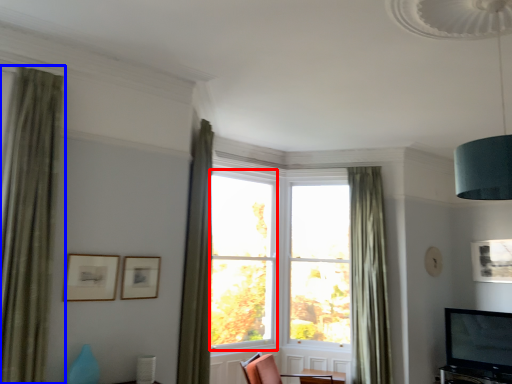
Question: Which object is further to the camera taking this photo, window (highlighted by a red box) or curtain (highlighted by a blue box)?

Choices:
 (A) window
 (B) curtain

Answer: (A)